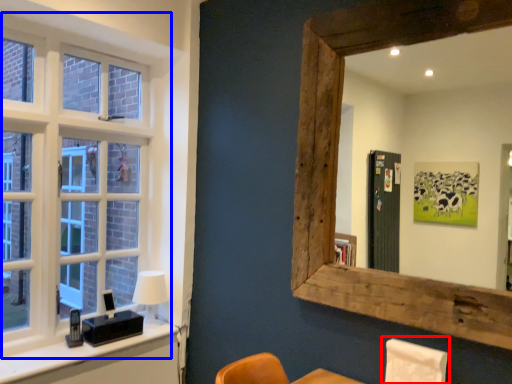
Question: Which object appears farthest to the camera in this image, swivel chair (highlighted by a red box) or window (highlighted by a blue box)?

Choices:
 (A) swivel chair
 (B) window

Answer: (B)